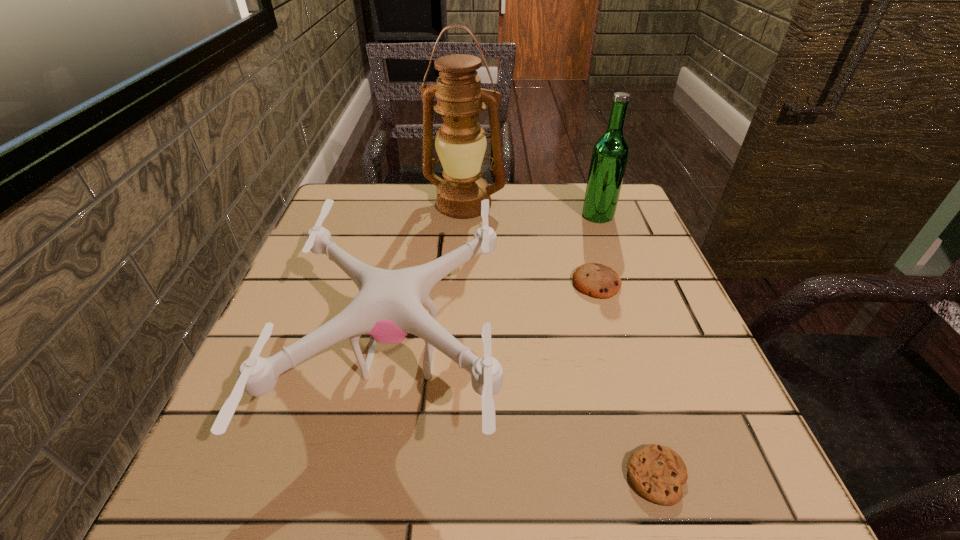
The image size is (960, 540). In order to click on blank area located 0.370m on the left of the second shortest object in this screenshot , I will do click(390, 283).

Find the location of a particular element. This screenshot has height=540, width=960. free space located 0.110m on the left of the shorter cookie is located at coordinates click(x=545, y=476).

I want to click on oil lamp at the far edge, so click(460, 143).

This screenshot has width=960, height=540. I want to click on beer bottle located at the far edge, so click(610, 153).

At what (x,y) coordinates should I click in order to perform the action: click on drone positioned at the near edge. Please return your answer as a coordinate pair (x, y). The height and width of the screenshot is (540, 960). Looking at the image, I should click on (389, 306).

You are a GUI agent. You are given a task and a screenshot of the screen. Output one action in this format:
    pyautogui.click(x=<x>, y=<y>)
    Task: Click on the cookie that is at the near edge
    The height and width of the screenshot is (540, 960).
    Given the screenshot: What is the action you would take?
    pyautogui.click(x=657, y=472)

Image resolution: width=960 pixels, height=540 pixels. Find the location of `object that is at the left edge`. object that is at the left edge is located at coordinates (389, 306).

Where is `beer bottle at the right edge`? This screenshot has width=960, height=540. beer bottle at the right edge is located at coordinates (610, 153).

Locate an element on the screen. The width and height of the screenshot is (960, 540). object present at the near left corner is located at coordinates (389, 306).

Find the location of a particular element. The height and width of the screenshot is (540, 960). object located at the far right corner is located at coordinates (610, 153).